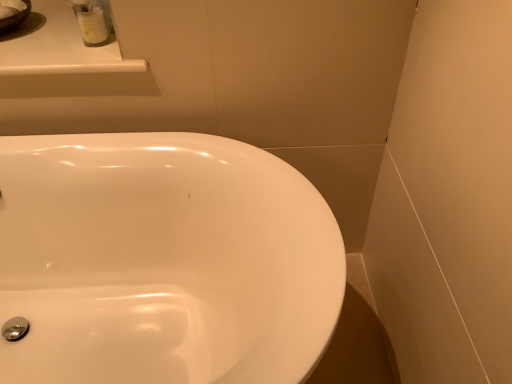
Question: In terms of size, does white glossy sink at center appear bigger or smaller than white glossy counter top at upper left?

Choices:
 (A) small
 (B) big

Answer: (B)

Question: From a real-world perspective, relative to white glossy counter top at upper left, is white glossy sink at center vertically above or below?

Choices:
 (A) below
 (B) above

Answer: (A)

Question: Considering the real-world distances, which object is closest to the white glossy container at upper left?

Choices:
 (A) white glossy counter top at upper left
 (B) white glossy sink at center

Answer: (A)

Question: Which of these objects is positioned farthest from the white glossy sink at center?

Choices:
 (A) white glossy counter top at upper left
 (B) white glossy container at upper left

Answer: (B)